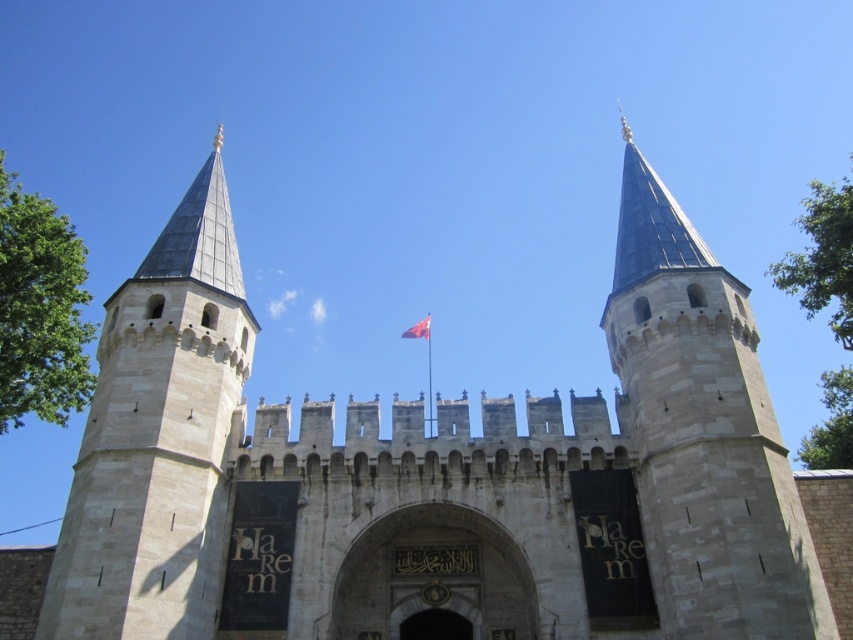
Between light beige stone tower at left and dark stone archway at center, which one has less height?

Standing shorter between the two is dark stone archway at center.

Between point (129, 396) and point (462, 630), which one is positioned in front?

Positioned in front is point (129, 396).

Image resolution: width=853 pixels, height=640 pixels. I want to click on light beige stone tower at left, so click(x=157, y=436).

Locate an element on the screen. light beige stone tower at left is located at coordinates (157, 436).

Is point (741, 492) farther from viewer compared to point (200, 499)?

No, it is not.

Is stone tower at center bigger than light beige stone tower at left?

Incorrect, stone tower at center is not larger than light beige stone tower at left.

This screenshot has width=853, height=640. I want to click on stone tower at center, so tap(704, 435).

Is stone tower at center behind dark stone archway at center?

No, stone tower at center is in front of dark stone archway at center.

Can you confirm if stone tower at center is smaller than dark stone archway at center?

No.

You are a GUI agent. You are given a task and a screenshot of the screen. Output one action in this format:
    pyautogui.click(x=<x>, y=<y>)
    Task: Click on the stone tower at center
    
    Given the screenshot: What is the action you would take?
    pyautogui.click(x=704, y=435)